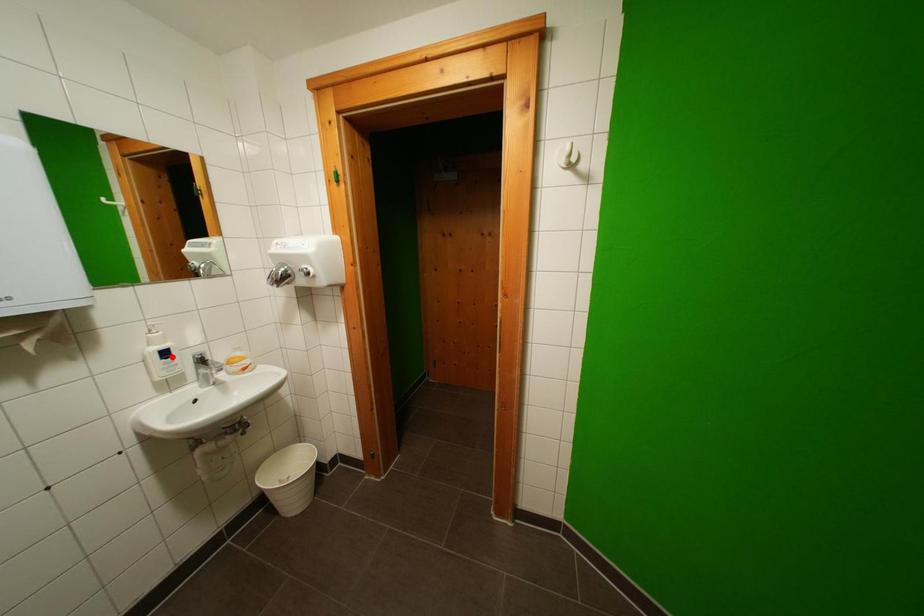
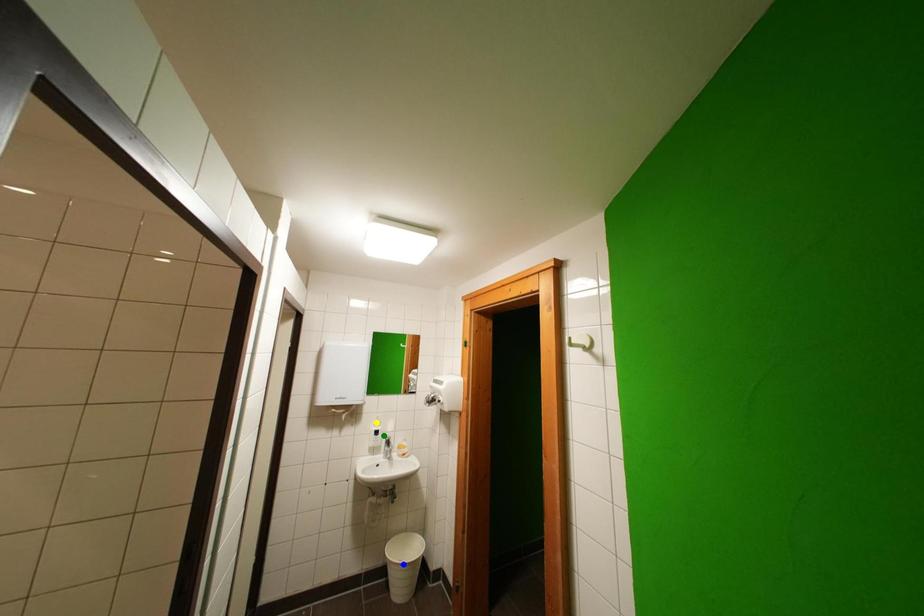
Question: I am providing you with two images of the same scene from different viewpoints. A red point is marked on the first image. You are given multiple points on the second image. In image 2, which mark is for the same physical point as the one in image 1?

Choices:
 (A) yellow point
 (B) blue point
 (C) green point

Answer: (C)